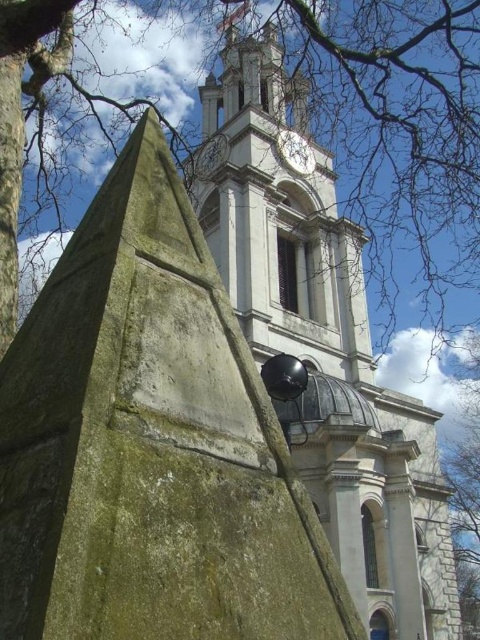
Find the location of a particular element. white stone clock tower at upper center is located at coordinates (277, 216).

What do you see at coordinates (277, 216) in the screenshot? I see `white stone clock tower at upper center` at bounding box center [277, 216].

The height and width of the screenshot is (640, 480). Identify the location of white stone clock tower at upper center. (277, 216).